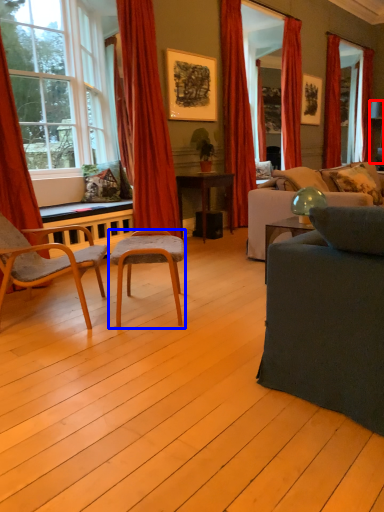
Question: Among these objects, which one is nearest to the camera, lamp (highlighted by a red box) or chair (highlighted by a blue box)?

Choices:
 (A) lamp
 (B) chair

Answer: (B)